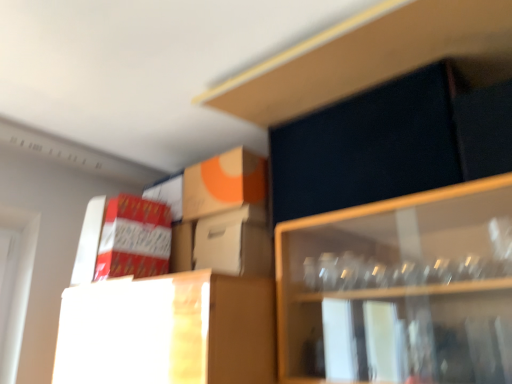
In the scene shown: What is the approximate height of white cardboard box at center, marked as the 3th cardboard box in a left-to-right arrangement?

The height of white cardboard box at center, marked as the 3th cardboard box in a left-to-right arrangement, is 7.72 inches.

Where is `white cardboard box at center, marked as the 3th cardboard box in a left-to-right arrangement`? white cardboard box at center, marked as the 3th cardboard box in a left-to-right arrangement is located at coordinates (234, 242).

What do you see at coordinates (371, 57) in the screenshot? I see `dark matte cabinet at upper right` at bounding box center [371, 57].

I want to click on orange matte cardboard box at upper center, which is the second cardboard box in right-to-left order, so click(x=223, y=183).

Looking at the image, does white cardboard box at center, which appears as the first cardboard box when viewed from the right, seem bigger or smaller compared to orange matte cardboard box at upper center, which is the second cardboard box in right-to-left order?

Considering their sizes, white cardboard box at center, which appears as the first cardboard box when viewed from the right, takes up less space than orange matte cardboard box at upper center, which is the second cardboard box in right-to-left order.

Image resolution: width=512 pixels, height=384 pixels. Identify the location of the 1st cardboard box to the left of the white cardboard box at center, which appears as the first cardboard box when viewed from the right, counting from the anchor's position. (223, 183).

Is point (230, 238) positioned behind point (202, 204)?

No.

Considering the positions of objects dark matte cabinet at upper right and white cardboard box at center, marked as the 3th cardboard box in a left-to-right arrangement, in the image provided, who is more to the left, dark matte cabinet at upper right or white cardboard box at center, marked as the 3th cardboard box in a left-to-right arrangement,?

Positioned to the left is white cardboard box at center, marked as the 3th cardboard box in a left-to-right arrangement.

From the image's perspective, which one is positioned higher, dark matte cabinet at upper right or white cardboard box at center, marked as the 3th cardboard box in a left-to-right arrangement?

dark matte cabinet at upper right is shown above in the image.

Who is more distant, dark matte cabinet at upper right or white cardboard box at center, which appears as the first cardboard box when viewed from the right?

white cardboard box at center, which appears as the first cardboard box when viewed from the right, is behind.

Who is taller, dark matte cabinet at upper right or white cardboard box at center, which appears as the first cardboard box when viewed from the right?

Standing taller between the two is white cardboard box at center, which appears as the first cardboard box when viewed from the right.

Considering the positions of objects red cardboard box at left, placed as the 3th cardboard box when sorted from right to left, and orange matte cardboard box at upper center, placed as the 2th cardboard box when sorted from left to right, in the image provided, who is more to the left, red cardboard box at left, placed as the 3th cardboard box when sorted from right to left, or orange matte cardboard box at upper center, placed as the 2th cardboard box when sorted from left to right,?

From the viewer's perspective, red cardboard box at left, placed as the 3th cardboard box when sorted from right to left, appears more on the left side.

Which is behind, point (157, 271) or point (258, 155)?

The point (157, 271) is farther.

Is red cardboard box at left, placed as the 3th cardboard box when sorted from right to left, thinner than orange matte cardboard box at upper center, placed as the 2th cardboard box when sorted from left to right?

No.

Can you see red cardboard box at left, the first cardboard box viewed from the left, touching orange matte cardboard box at upper center, which is the second cardboard box in right-to-left order?

red cardboard box at left, the first cardboard box viewed from the left, is not next to orange matte cardboard box at upper center, which is the second cardboard box in right-to-left order, and they're not touching.

Which is behind, orange matte cardboard box at upper center, placed as the 2th cardboard box when sorted from left to right, or dark matte cabinet at upper right?

orange matte cardboard box at upper center, placed as the 2th cardboard box when sorted from left to right.

From the image's perspective, count 1st cardboard boxs downward from the dark matte cabinet at upper right and point to it. Please provide its 2D coordinates.

[(223, 183)]

Can you confirm if orange matte cardboard box at upper center, which is the second cardboard box in right-to-left order, is taller than dark matte cabinet at upper right?

Indeed, orange matte cardboard box at upper center, which is the second cardboard box in right-to-left order, has a greater height compared to dark matte cabinet at upper right.

Which of these two, orange matte cardboard box at upper center, placed as the 2th cardboard box when sorted from left to right, or dark matte cabinet at upper right, is wider?

With larger width is dark matte cabinet at upper right.

Choose the correct answer: Is red cardboard box at left, the first cardboard box viewed from the left, inside dark matte cabinet at upper right or outside it?

The correct answer is: outside.

Is red cardboard box at left, the first cardboard box viewed from the left, thinner than dark matte cabinet at upper right?

Yes.

Which is in front, red cardboard box at left, placed as the 3th cardboard box when sorted from right to left, or dark matte cabinet at upper right?

dark matte cabinet at upper right.

From a real-world perspective, which is physically above, white cardboard box at center, marked as the 3th cardboard box in a left-to-right arrangement, or red cardboard box at left, the first cardboard box viewed from the left?

red cardboard box at left, the first cardboard box viewed from the left, from a real-world perspective.

Which of these two, white cardboard box at center, marked as the 3th cardboard box in a left-to-right arrangement, or red cardboard box at left, placed as the 3th cardboard box when sorted from right to left, is wider?

With larger width is red cardboard box at left, placed as the 3th cardboard box when sorted from right to left.

Considering the relative sizes of white cardboard box at center, marked as the 3th cardboard box in a left-to-right arrangement, and red cardboard box at left, placed as the 3th cardboard box when sorted from right to left, in the image provided, is white cardboard box at center, marked as the 3th cardboard box in a left-to-right arrangement, smaller than red cardboard box at left, placed as the 3th cardboard box when sorted from right to left,?

Incorrect, white cardboard box at center, marked as the 3th cardboard box in a left-to-right arrangement, is not smaller in size than red cardboard box at left, placed as the 3th cardboard box when sorted from right to left.

Which is more distant, (251, 224) or (115, 216)?

The point (115, 216) is behind.

Is white cardboard box at center, marked as the 3th cardboard box in a left-to-right arrangement, facing away from dark matte cabinet at upper right?

No, white cardboard box at center, marked as the 3th cardboard box in a left-to-right arrangement,'s orientation is not away from dark matte cabinet at upper right.

From a real-world perspective, is white cardboard box at center, which appears as the first cardboard box when viewed from the right, over dark matte cabinet at upper right?

No, from a real-world perspective, white cardboard box at center, which appears as the first cardboard box when viewed from the right, is not above dark matte cabinet at upper right.

How many degrees apart are the facing directions of white cardboard box at center, marked as the 3th cardboard box in a left-to-right arrangement, and dark matte cabinet at upper right?

0.000427 degrees separate the facing orientations of white cardboard box at center, marked as the 3th cardboard box in a left-to-right arrangement, and dark matte cabinet at upper right.

I want to click on the 2nd cardboard box above the white cardboard box at center, which appears as the first cardboard box when viewed from the right (from the image's perspective), so (223, 183).

This screenshot has height=384, width=512. Identify the location of the 3rd cardboard box below when counting from the dark matte cabinet at upper right (from the image's perspective). (234, 242).

From the image, which object appears to be nearer to white cardboard box at center, marked as the 3th cardboard box in a left-to-right arrangement, orange matte cardboard box at upper center, which is the second cardboard box in right-to-left order, or red cardboard box at left, placed as the 3th cardboard box when sorted from right to left?

orange matte cardboard box at upper center, which is the second cardboard box in right-to-left order, lies closer to white cardboard box at center, marked as the 3th cardboard box in a left-to-right arrangement, than the other object.

Based on their spatial positions, is dark matte cabinet at upper right or red cardboard box at left, the first cardboard box viewed from the left, further from white cardboard box at center, which appears as the first cardboard box when viewed from the right?

dark matte cabinet at upper right.

Considering their positions, is white cardboard box at center, which appears as the first cardboard box when viewed from the right, positioned further to red cardboard box at left, the first cardboard box viewed from the left, than orange matte cardboard box at upper center, which is the second cardboard box in right-to-left order?

The object further to red cardboard box at left, the first cardboard box viewed from the left, is white cardboard box at center, which appears as the first cardboard box when viewed from the right.

Which object lies nearer to the anchor point red cardboard box at left, the first cardboard box viewed from the left, orange matte cardboard box at upper center, which is the second cardboard box in right-to-left order, or white cardboard box at center, which appears as the first cardboard box when viewed from the right?

orange matte cardboard box at upper center, which is the second cardboard box in right-to-left order, lies closer to red cardboard box at left, the first cardboard box viewed from the left, than the other object.

From the image, which object appears to be farther from white cardboard box at center, marked as the 3th cardboard box in a left-to-right arrangement, orange matte cardboard box at upper center, placed as the 2th cardboard box when sorted from left to right, or dark matte cabinet at upper right?

dark matte cabinet at upper right is positioned further to the anchor white cardboard box at center, marked as the 3th cardboard box in a left-to-right arrangement.

Looking at this image, which object lies further to the anchor point red cardboard box at left, the first cardboard box viewed from the left, orange matte cardboard box at upper center, which is the second cardboard box in right-to-left order, or dark matte cabinet at upper right?

dark matte cabinet at upper right is positioned further to the anchor red cardboard box at left, the first cardboard box viewed from the left.

Estimate the real-world distances between objects in this image. Which object is closer to dark matte cabinet at upper right, red cardboard box at left, the first cardboard box viewed from the left, or white cardboard box at center, marked as the 3th cardboard box in a left-to-right arrangement?

white cardboard box at center, marked as the 3th cardboard box in a left-to-right arrangement, is closer to dark matte cabinet at upper right.

Which object lies further to the anchor point white cardboard box at center, marked as the 3th cardboard box in a left-to-right arrangement, red cardboard box at left, the first cardboard box viewed from the left, or orange matte cardboard box at upper center, which is the second cardboard box in right-to-left order?

red cardboard box at left, the first cardboard box viewed from the left, is positioned further to the anchor white cardboard box at center, marked as the 3th cardboard box in a left-to-right arrangement.

The width and height of the screenshot is (512, 384). Identify the location of cardboard box between red cardboard box at left, the first cardboard box viewed from the left, and white cardboard box at center, which appears as the first cardboard box when viewed from the right, from left to right. (223, 183).